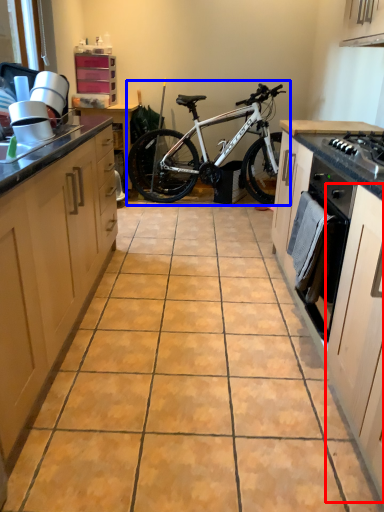
Question: Which of the following is the closest to the observer, cabinetry (highlighted by a red box) or bicycle (highlighted by a blue box)?

Choices:
 (A) cabinetry
 (B) bicycle

Answer: (A)